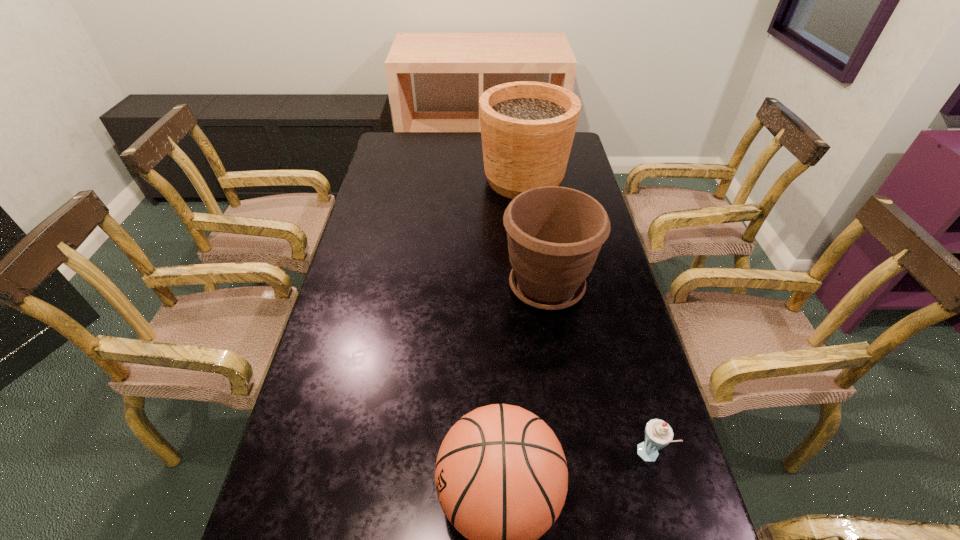
The height and width of the screenshot is (540, 960). I want to click on milkshake present at the right edge, so click(x=658, y=434).

The width and height of the screenshot is (960, 540). I want to click on object present at the far right corner, so click(527, 128).

You are a GUI agent. You are given a task and a screenshot of the screen. Output one action in this format:
    pyautogui.click(x=<x>, y=<y>)
    Task: Click on the vacant space at the far edge
    The width and height of the screenshot is (960, 540).
    Given the screenshot: What is the action you would take?
    pyautogui.click(x=450, y=158)

In the image, there is a desktop. Where is `free region at the left edge`? free region at the left edge is located at coordinates (386, 219).

Identify the location of blank space at the right edge of the desktop. (646, 518).

This screenshot has height=540, width=960. Find the location of `empty location between the nearer flowerpot and the milkshake`. empty location between the nearer flowerpot and the milkshake is located at coordinates (598, 371).

This screenshot has height=540, width=960. Identify the location of free space between the shorter flowerpot and the shortest object. (598, 371).

Identify the location of vacant space in between the shorter flowerpot and the milkshake. The width and height of the screenshot is (960, 540). (598, 371).

Where is `vacant area that lies between the shortest object and the second farthest object`? The width and height of the screenshot is (960, 540). vacant area that lies between the shortest object and the second farthest object is located at coordinates (598, 371).

Identify which object is located as the third nearest to the shorter flowerpot. Please provide its 2D coordinates. Your answer should be formatted as a tuple, i.e. [(x, y)], where the tuple contains the x and y coordinates of a point satisfying the conditions above.

[(658, 434)]